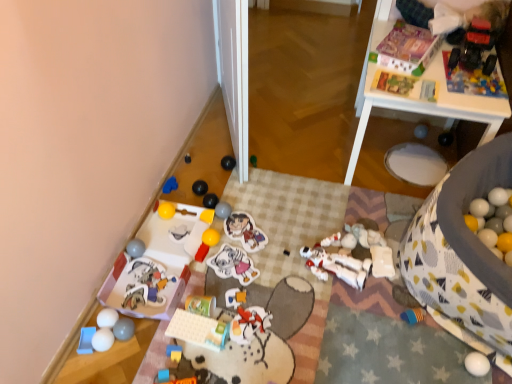
Where is `vacant area situated to the left side of white matte doll at center, acting as the 22th toy starting from the left`? The height and width of the screenshot is (384, 512). vacant area situated to the left side of white matte doll at center, acting as the 22th toy starting from the left is located at coordinates (276, 264).